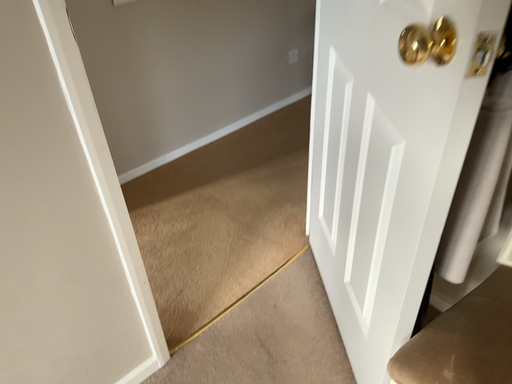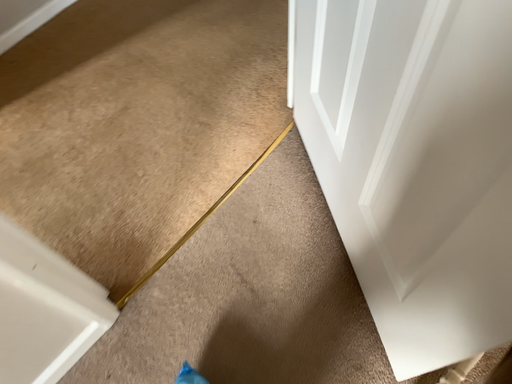
Question: Which way did the camera rotate in the video?

Choices:
 (A) rotated upward
 (B) rotated downward

Answer: (B)